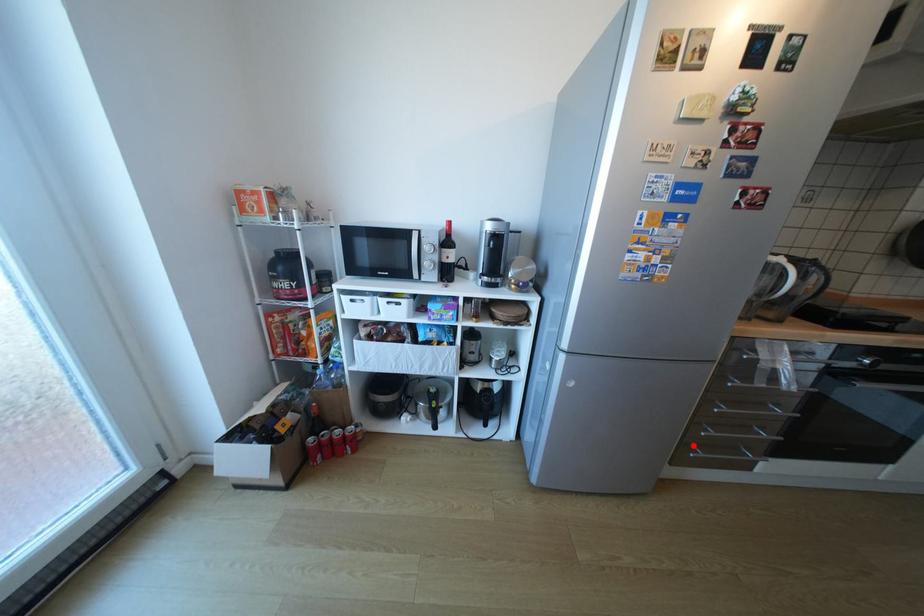
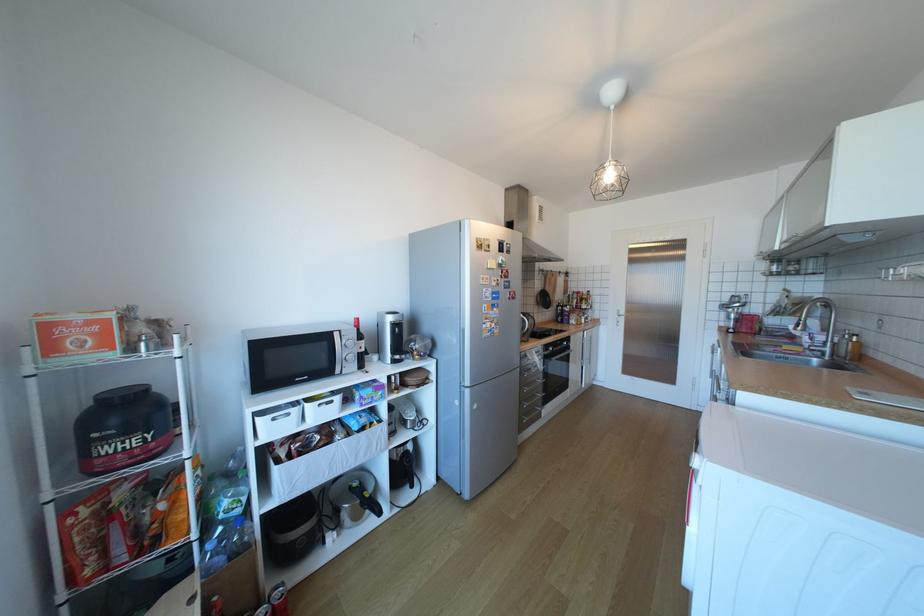
Question: A red point is marked in image1. In image2, is the corresponding 3D point closer to the camera or farther? Reply with the corresponding letter.

Choices:
 (A) The corresponding 3D point is closer.
 (B) The corresponding 3D point is farther.

Answer: (B)